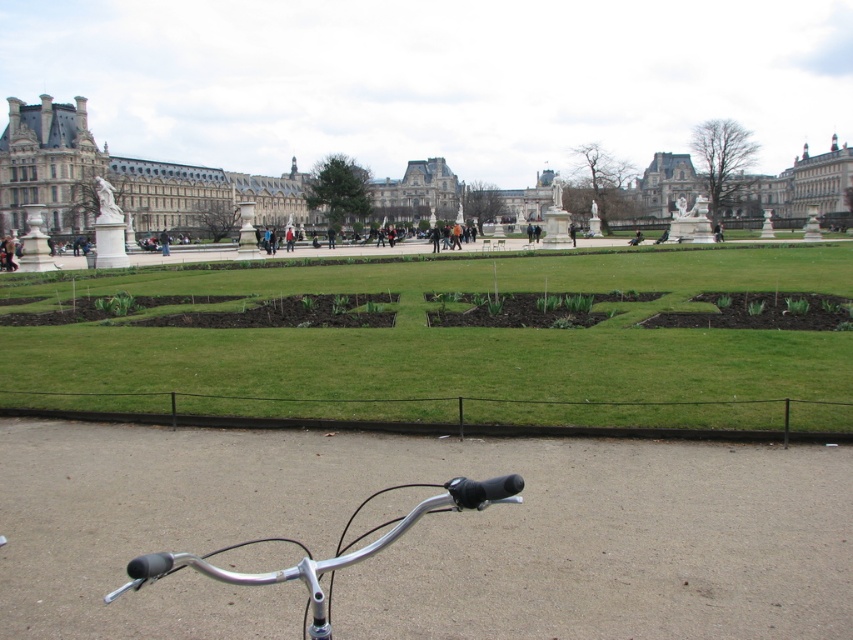
How distant is green grass at center from silver metallic bicycle handlebars at lower center?

The distance of green grass at center from silver metallic bicycle handlebars at lower center is 90.83 feet.

Does green grass at center have a smaller size compared to silver metallic bicycle handlebars at lower center?

Actually, green grass at center might be larger than silver metallic bicycle handlebars at lower center.

Does point (158, 410) come behind point (520, 481)?

That is True.

You are a GUI agent. You are given a task and a screenshot of the screen. Output one action in this format:
    pyautogui.click(x=<x>, y=<y>)
    Task: Click on the green grass at center
    This screenshot has height=640, width=853.
    Given the screenshot: What is the action you would take?
    pyautogui.click(x=422, y=360)

From the picture: Can you confirm if white stone palace at center is thinner than silver metallic bicycle handlebars at lower center?

No.

Is point (230, 177) positioned before point (453, 492)?

No, it is behind (453, 492).

The height and width of the screenshot is (640, 853). Find the location of `white stone palace at center`. white stone palace at center is located at coordinates (90, 164).

Which is more to the left, green grass at center or white stone palace at center?

green grass at center

Can you confirm if green grass at center is positioned to the right of white stone palace at center?

In fact, green grass at center is to the left of white stone palace at center.

In order to click on green grass at center in this screenshot , I will do `click(422, 360)`.